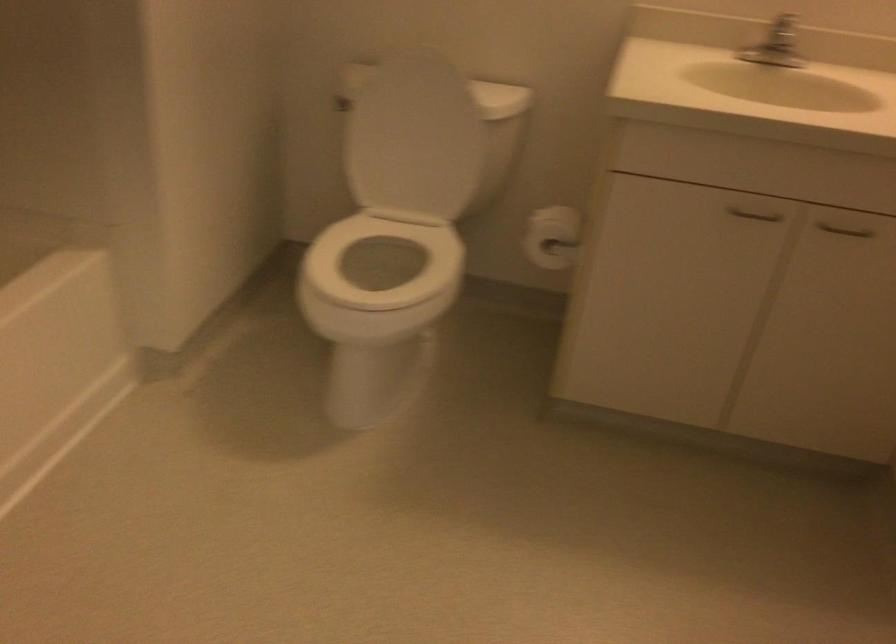
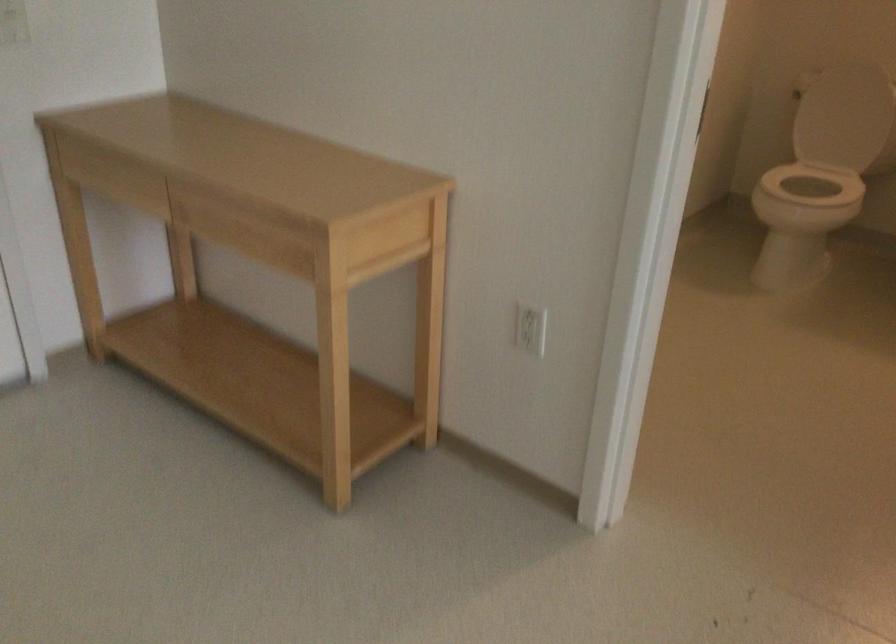
Where in the second image is the point corresponding to pixel 366 267 from the first image?

(814, 184)